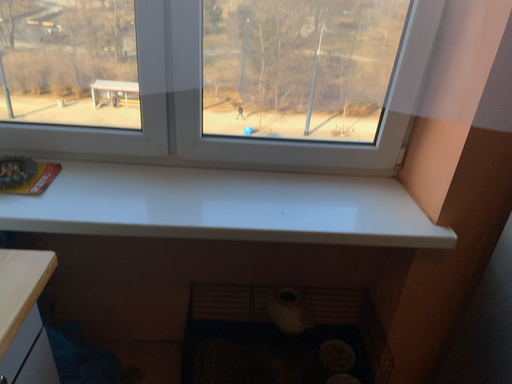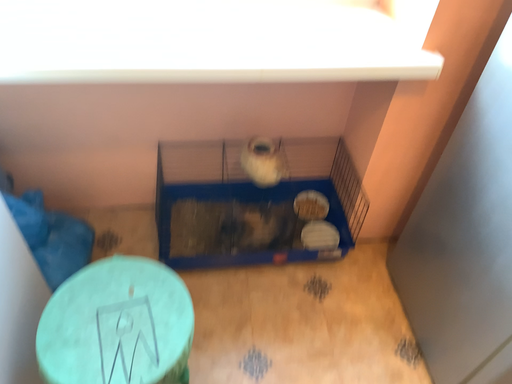
Question: Which way did the camera rotate in the video?

Choices:
 (A) rotated downward
 (B) rotated upward

Answer: (A)